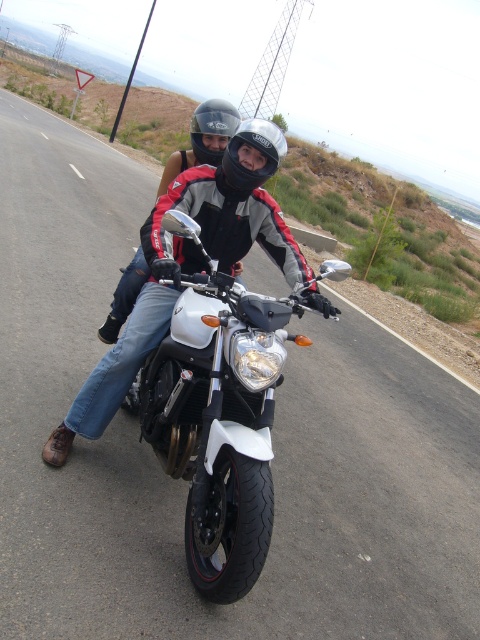
Does white matte motorcycle at center appear over black matte helmet at center?

Incorrect, white matte motorcycle at center is not positioned above black matte helmet at center.

What do you see at coordinates (217, 417) in the screenshot? Image resolution: width=480 pixels, height=640 pixels. I see `white matte motorcycle at center` at bounding box center [217, 417].

I want to click on white matte motorcycle at center, so click(x=217, y=417).

Does white matte motorcycle at center appear on the right side of glossy black helmet at center?

Yes, white matte motorcycle at center is to the right of glossy black helmet at center.

Does white matte motorcycle at center come behind glossy black helmet at center?

No.

The height and width of the screenshot is (640, 480). What are the coordinates of `white matte motorcycle at center` in the screenshot? It's located at (217, 417).

Where is `white matte motorcycle at center`? The height and width of the screenshot is (640, 480). white matte motorcycle at center is located at coordinates (217, 417).

Which is more to the right, matte black motorcycle at center or glossy black helmet at center?

From the viewer's perspective, matte black motorcycle at center appears more on the right side.

Between point (131, 312) and point (213, 118), which one is positioned in front?

Point (213, 118)

Who is more distant from viewer, [168,196] or [211,157]?

Positioned behind is point [211,157].

Find the location of `matte black motorcycle at center`. matte black motorcycle at center is located at coordinates (189, 266).